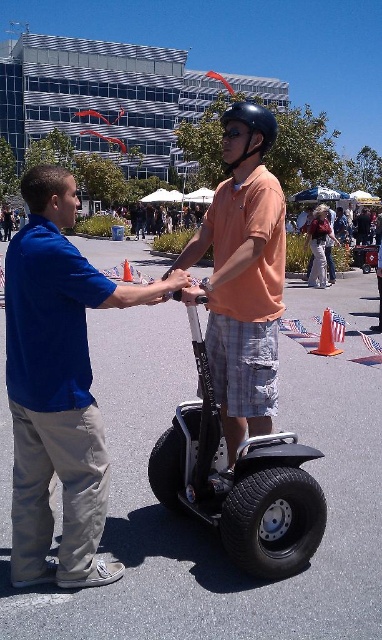
Question: Which object is farther from the camera taking this photo?

Choices:
 (A) orange plastic cone at center
 (B) black matte helmet at center
 (C) matte orange shirt at center
 (D) blue cotton shirt at center

Answer: (A)

Question: Can you confirm if black matte helmet at center is positioned to the right of orange plastic cone at center?

Choices:
 (A) no
 (B) yes

Answer: (A)

Question: Estimate the real-world distances between objects in this image. Which object is farther from the orange plastic cone at center?

Choices:
 (A) orange matte helmet at upper center
 (B) silver metallic scooter at center
 (C) matte orange shirt at center

Answer: (A)

Question: Does orange matte helmet at upper center have a greater width compared to orange traffic cone at center?

Choices:
 (A) yes
 (B) no

Answer: (A)

Question: Which point is closer to the camera?

Choices:
 (A) (307, 520)
 (B) (323, 316)

Answer: (A)

Question: Where is blue cotton shirt at center located in relation to orange traffic cone at center in the image?

Choices:
 (A) right
 (B) left

Answer: (A)